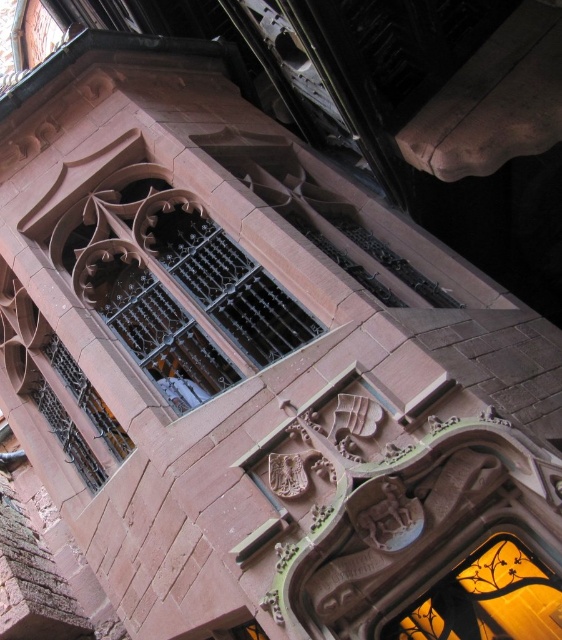
Between matte black metal window at center and translucent stained glass window at center, which one is positioned higher?

matte black metal window at center is higher up.

Measure the distance between point (201, 381) and camera.

Point (201, 381) and camera are 53.04 meters apart.

Where is `matte black metal window at center`? This screenshot has height=640, width=562. matte black metal window at center is located at coordinates (174, 285).